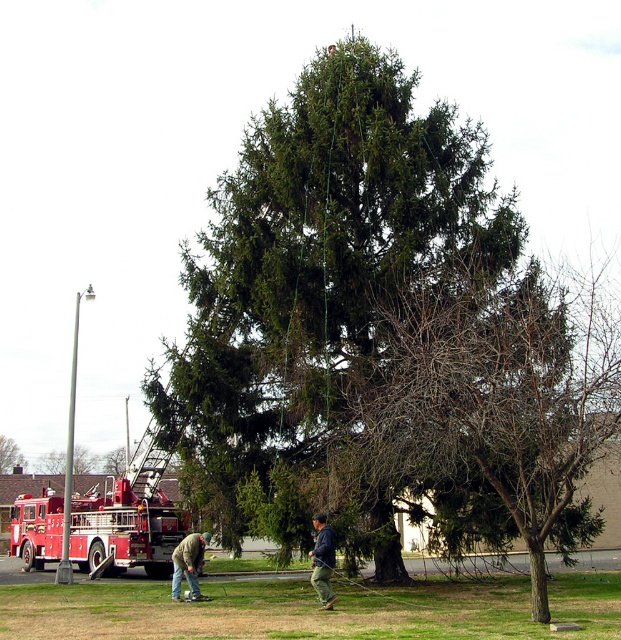
Is point (353, 305) closer to camera compared to point (179, 566)?

No, it is not.

Is point (315, 52) positioned before point (175, 595)?

No, (315, 52) is further to viewer.

You are a GUI agent. You are given a task and a screenshot of the screen. Output one action in this format:
    pyautogui.click(x=<x>, y=<y>)
    Task: Click on the green textured tree at center
    
    Given the screenshot: What is the action you would take?
    pyautogui.click(x=314, y=278)

Is brushed metal ladder at center positioned before green matte tree at center?

Yes, it is in front of green matte tree at center.

Who is positioned more to the right, brushed metal ladder at center or green matte tree at center?

brushed metal ladder at center is more to the right.

Describe the element at coordinates (147, 461) in the screenshot. I see `brushed metal ladder at center` at that location.

Where is `brushed metal ladder at center`? brushed metal ladder at center is located at coordinates (147, 461).

Does dark blue jeans at center lie in front of green denim jacket at lower left?

Yes.

Locate an element on the screen. This screenshot has width=621, height=640. dark blue jeans at center is located at coordinates (322, 561).